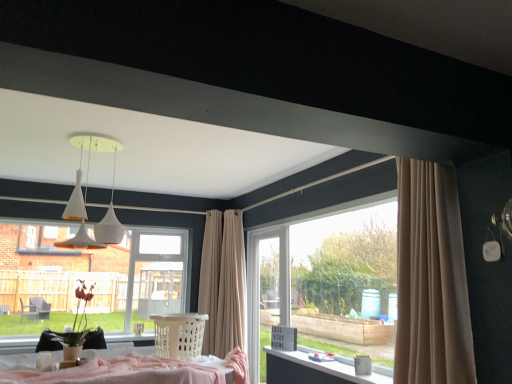
Question: From a real-world perspective, is beige fabric curtain at center positioned over white matte pendant lights at upper center based on gravity?

Choices:
 (A) yes
 (B) no

Answer: (B)

Question: From the image's perspective, is beige fabric curtain at center located beneath white matte pendant lights at upper center?

Choices:
 (A) no
 (B) yes

Answer: (B)

Question: Is beige fabric curtain at center shorter than white matte pendant lights at upper center?

Choices:
 (A) no
 (B) yes

Answer: (A)

Question: Does beige fabric curtain at center have a larger size compared to white matte pendant lights at upper center?

Choices:
 (A) yes
 (B) no

Answer: (A)

Question: Considering the relative sizes of beige fabric curtain at center and white matte pendant lights at upper center in the image provided, is beige fabric curtain at center wider than white matte pendant lights at upper center?

Choices:
 (A) no
 (B) yes

Answer: (A)

Question: From the image's perspective, is beige fabric curtain at center above white matte pendant lights at upper center?

Choices:
 (A) no
 (B) yes

Answer: (A)

Question: Is white glossy table at lower right bigger than white matte pendant lights at upper center?

Choices:
 (A) no
 (B) yes

Answer: (A)

Question: Is white glossy table at lower right to the right of white matte pendant lights at upper center from the viewer's perspective?

Choices:
 (A) yes
 (B) no

Answer: (A)

Question: Is white glossy table at lower right aimed at white matte pendant lights at upper center?

Choices:
 (A) no
 (B) yes

Answer: (A)

Question: From a real-world perspective, is white glossy table at lower right on white matte pendant lights at upper center?

Choices:
 (A) yes
 (B) no

Answer: (B)

Question: Are white glossy table at lower right and white matte pendant lights at upper center located far from each other?

Choices:
 (A) no
 (B) yes

Answer: (B)

Question: Does white glossy table at lower right come behind white matte pendant lights at upper center?

Choices:
 (A) yes
 (B) no

Answer: (A)

Question: Is white glossy table at lower right a part of white plastic laundry basket at center?

Choices:
 (A) yes
 (B) no

Answer: (B)